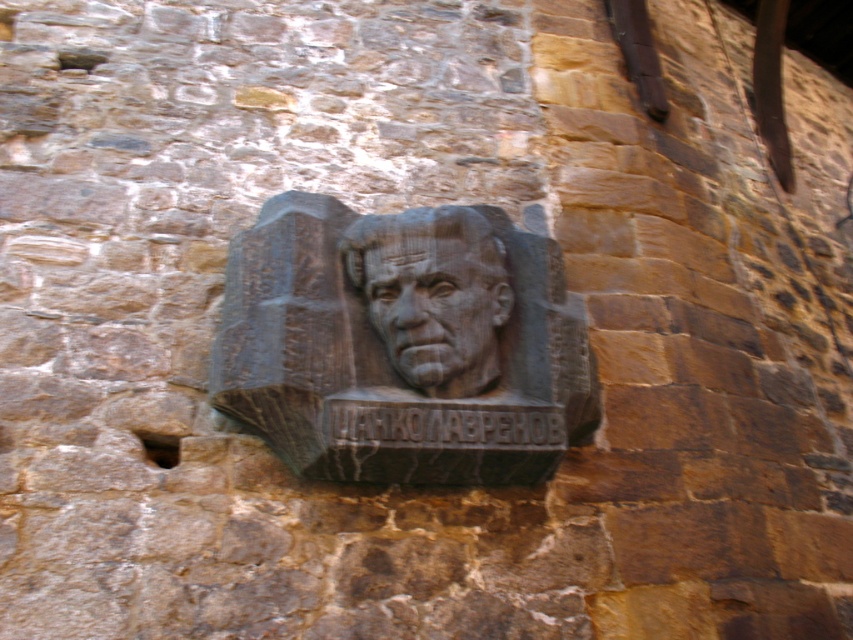
You are standing in front of the stone wall with the carved relief and plaque. There are two points marked on the wall at coordinates point (598, 410) and point (434, 278). If you were to draw a straight line from your current position to each of these points, which point would require the line to pass closer to the carved stone relief of the man?

Point (598, 410) is behind point (434, 278), so the line to point (598, 410) would pass closer to the carved stone relief of the man.

You are an archaeologist examining the stone wall. You need to locate the black stone relief at center. What are its coordinates on the wall?

The black stone relief at center is located at coordinates 0.539 on the x axis and 0.474 on the y axis.